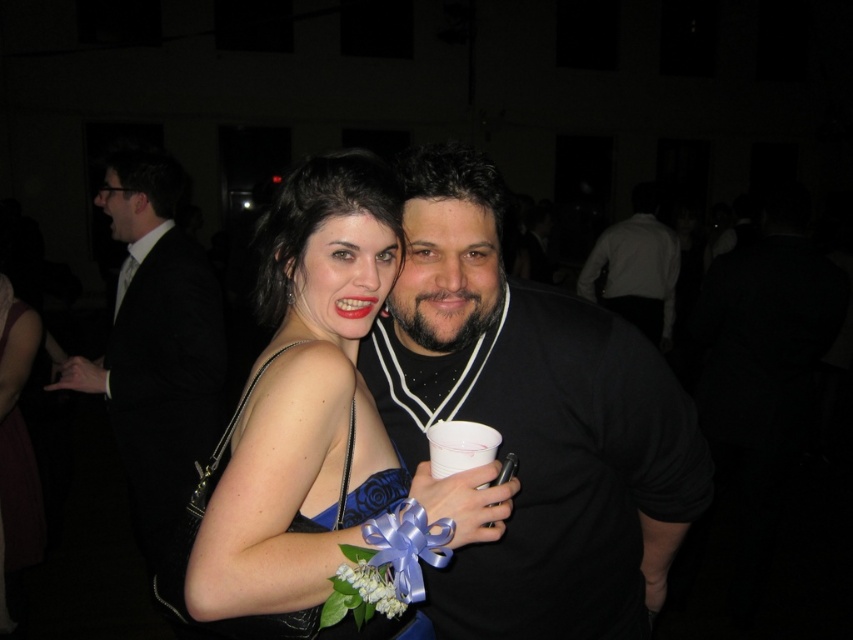
Question: Which object is farther from the camera taking this photo?

Choices:
 (A) satin blue dress at center
 (B) black matte shirt at center
 (C) white shirt at upper center

Answer: (C)

Question: Which object is the closest to the white shirt at upper center?

Choices:
 (A) satin blue dress at center
 (B) black matte shirt at center

Answer: (B)

Question: Which is nearer to the white shirt at upper center?

Choices:
 (A) black matte shirt at center
 (B) satin blue dress at center
 (C) black satin suit at left

Answer: (C)

Question: Does black matte shirt at center appear on the left side of black satin suit at left?

Choices:
 (A) no
 (B) yes

Answer: (A)

Question: Does satin blue dress at center have a greater width compared to white shirt at upper center?

Choices:
 (A) no
 (B) yes

Answer: (A)

Question: Does black matte shirt at center appear under satin blue dress at center?

Choices:
 (A) no
 (B) yes

Answer: (B)